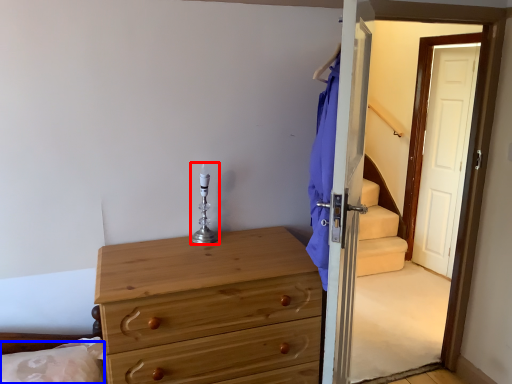
Question: Which object is closer to the camera taking this photo, candle holder (highlighted by a red box) or pillow (highlighted by a blue box)?

Choices:
 (A) candle holder
 (B) pillow

Answer: (B)